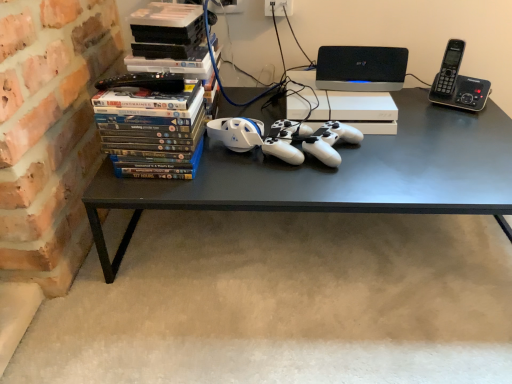
I want to click on free space in front of matte plastic dvds at left, so click(145, 191).